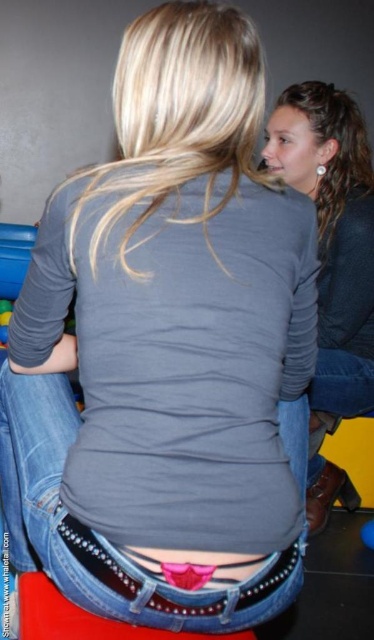
In the scene shown: You are a fashion designer observing the scene. You need to decide whether the studded denim belt at lower center can fit around the denim stool at lower center. Can it fit?

The studded denim belt at lower center has a lesser width compared to the denim stool at lower center, so it is possible that the belt could fit around the stool if the stool is wider. However, the width of the belt itself is not the determining factor here. The critical measurement would be the circumference of the stool compared to the belt length. Since the description only mentions width, we cannot definitively confirm if the belt can fit around the denim stool at lower center.

You are a photographer standing at the point marked as point (x=68, y=518). You want to take a photo of the two people sitting nearby. Considering the distance between them, will you be able to capture both individuals in a single frame without moving the camera?

The two people are 25.96 inches apart. Since the photographer is at point (x=68, y=518), which is one of the individuals, capturing both in a single frame depends on the camera lens. However, the distance between them is relatively close, so a standard lens should allow both to be in frame without moving.